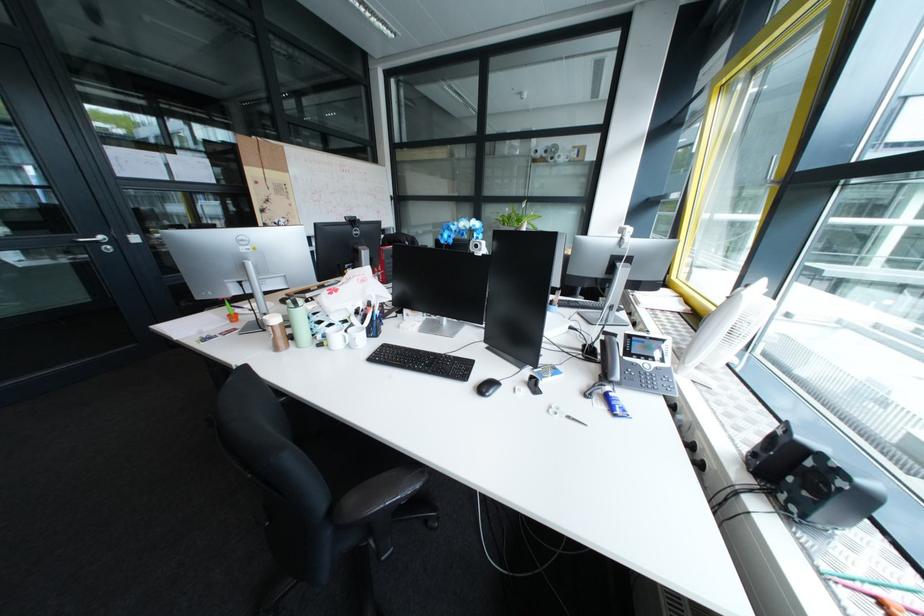
Identify the location of brown shaker cup. The height and width of the screenshot is (616, 924). (275, 331).